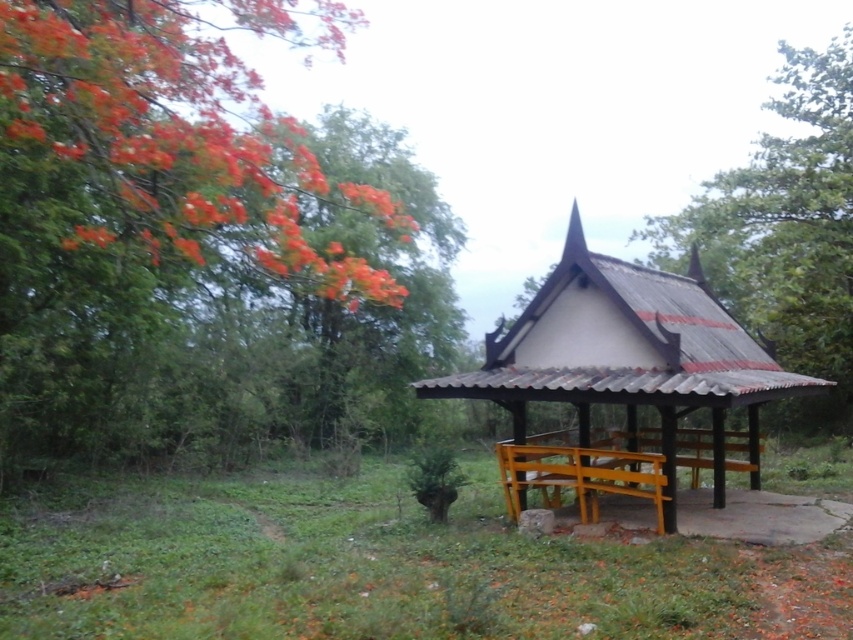
Looking at this image, is orange blossoms at upper left taller than wooden bench at center?

Yes.

Where is `orange blossoms at upper left`? orange blossoms at upper left is located at coordinates (144, 188).

Find the location of `orange blossoms at upper left`. orange blossoms at upper left is located at coordinates (144, 188).

This screenshot has width=853, height=640. What do you see at coordinates (628, 355) in the screenshot? I see `wooden bench at center` at bounding box center [628, 355].

Is wooden bench at center thinner than green leafy tree at upper right?

Correct, wooden bench at center's width is less than green leafy tree at upper right's.

Is point (604, 298) positioned after point (827, 256)?

No, it is not.

Find the location of a particular element. This screenshot has height=640, width=853. wooden bench at center is located at coordinates (628, 355).

Is orange blossoms at upper left shorter than green leafy tree at upper right?

Yes, orange blossoms at upper left is shorter than green leafy tree at upper right.

Can you confirm if orange blossoms at upper left is smaller than green leafy tree at upper right?

Correct, orange blossoms at upper left occupies less space than green leafy tree at upper right.

Does point (67, 189) come behind point (817, 228)?

No, (67, 189) is closer to viewer.

Where is `orange blossoms at upper left`? orange blossoms at upper left is located at coordinates (144, 188).